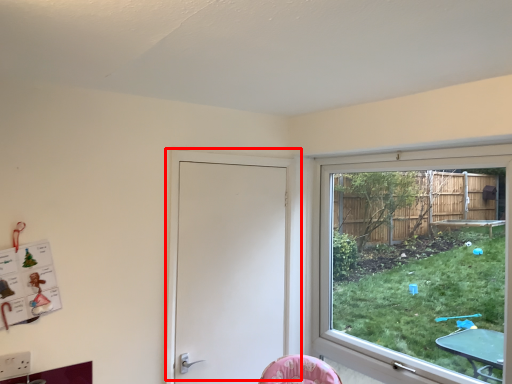
Question: Considering the relative positions of door (annotated by the red box) and window in the image provided, where is door (annotated by the red box) located with respect to the staircase?

Choices:
 (A) left
 (B) right

Answer: (A)